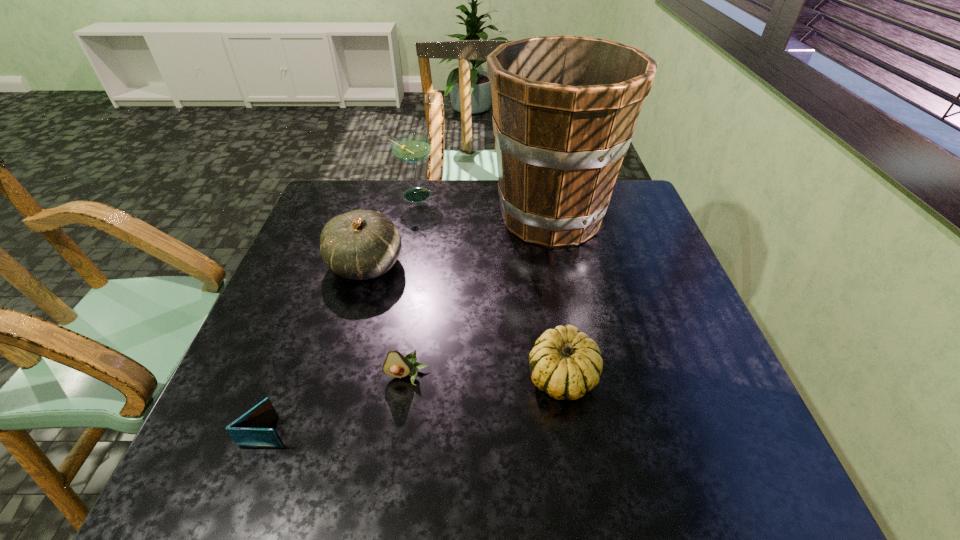
The width and height of the screenshot is (960, 540). I want to click on the tallest object, so tap(565, 108).

At what (x,y) coordinates should I click in order to perform the action: click on martini. Please return your answer as a coordinate pair (x, y). This screenshot has width=960, height=540. Looking at the image, I should click on (411, 148).

Identify the location of the taller gourd. The image size is (960, 540). click(361, 244).

Where is `the farther gourd`? The height and width of the screenshot is (540, 960). the farther gourd is located at coordinates (361, 244).

This screenshot has width=960, height=540. Find the location of `the shorter gourd`. the shorter gourd is located at coordinates (565, 363).

Identify the location of the fourth tallest object. (565, 363).

Find the location of a particular element. This screenshot has width=960, height=540. avocado is located at coordinates (396, 365).

Locate an element on the screen. This screenshot has width=960, height=540. wallet is located at coordinates (250, 430).

Locate an element on the screen. the shortest object is located at coordinates (250, 430).

Where is `free spot located on the left of the tallest object`? free spot located on the left of the tallest object is located at coordinates (410, 217).